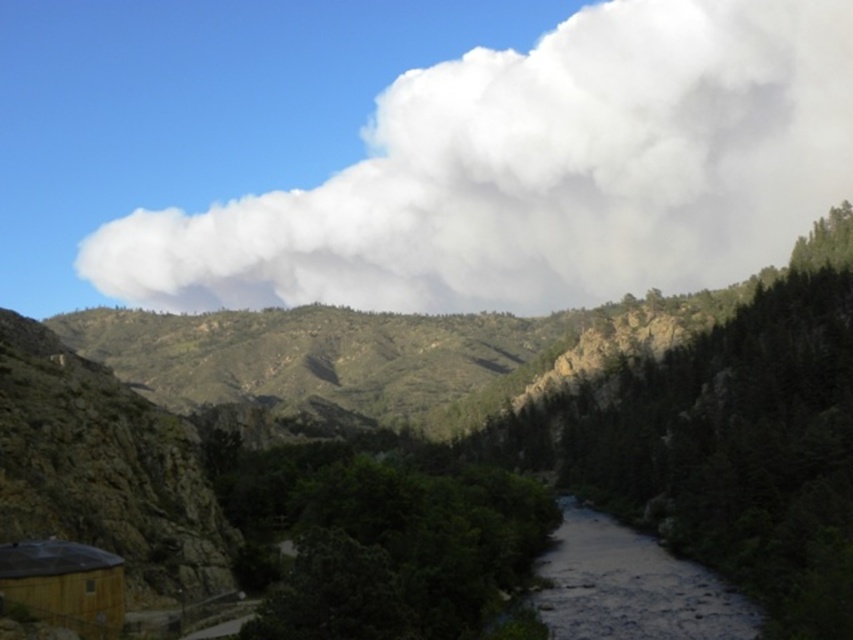
Is white fluffy cloud at upper center in front of dark gray smooth river at center?

That is False.

Can you confirm if white fluffy cloud at upper center is taller than dark gray smooth river at center?

Yes.

Who is more forward, [759,156] or [734,608]?

Point [734,608] is more forward.

Where is `white fluffy cloud at upper center`? The height and width of the screenshot is (640, 853). white fluffy cloud at upper center is located at coordinates (538, 173).

Is point (612, 12) closer to viewer compared to point (9, 561)?

No, (612, 12) is further to viewer.

Can you confirm if white fluffy cloud at upper center is positioned above brown wooden hut at lower left?

Indeed, white fluffy cloud at upper center is positioned over brown wooden hut at lower left.

Consider the image. Who is more forward, (618, 42) or (10, 600)?

Point (10, 600) is in front.

At what (x,y) coordinates should I click in order to perform the action: click on white fluffy cloud at upper center. Please return your answer as a coordinate pair (x, y). This screenshot has height=640, width=853. Looking at the image, I should click on (538, 173).

Who is taller, dark gray smooth river at center or brown wooden hut at lower left?

With more height is dark gray smooth river at center.

Based on the photo, does dark gray smooth river at center have a greater height compared to brown wooden hut at lower left?

Indeed, dark gray smooth river at center has a greater height compared to brown wooden hut at lower left.

Is point (637, 566) behind point (27, 600)?

Yes, point (637, 566) is behind point (27, 600).

Where is `dark gray smooth river at center`? dark gray smooth river at center is located at coordinates (630, 586).